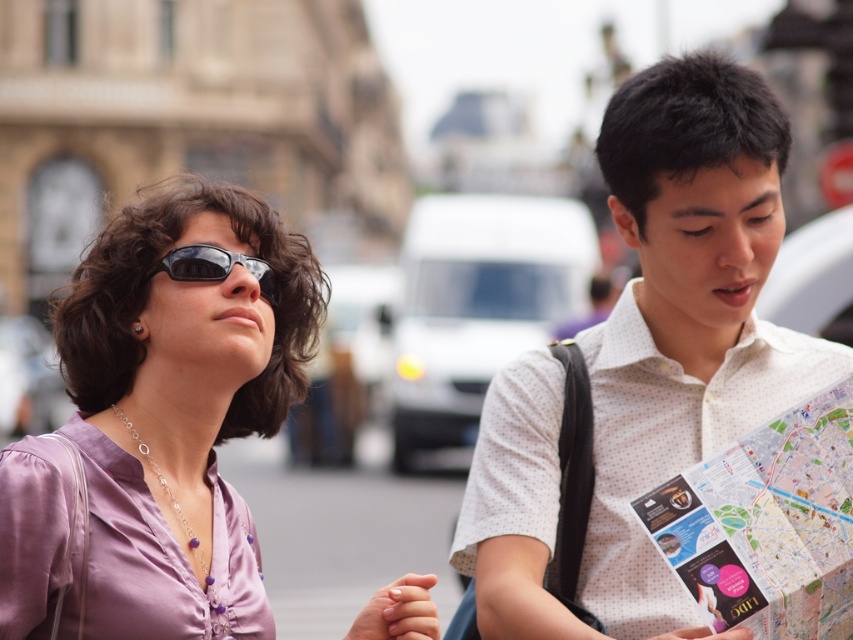
What are the coordinates of the white dotted shirt at center?

The white dotted shirt at center is located at coordinates point (685, 314).